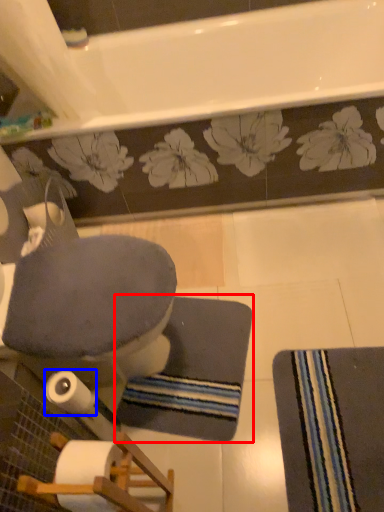
Question: Among these objects, which one is farthest to the camera, bath mat (highlighted by a red box) or toilet paper (highlighted by a blue box)?

Choices:
 (A) bath mat
 (B) toilet paper

Answer: (A)